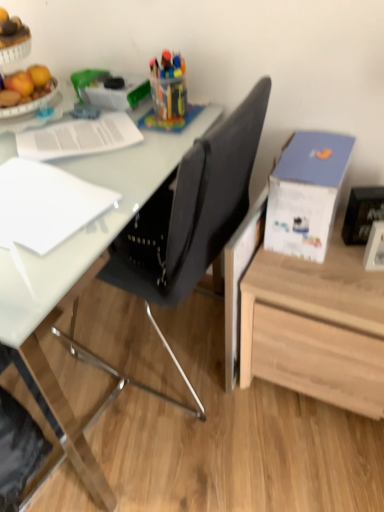
The width and height of the screenshot is (384, 512). Identify the location of free space in front of white paper at left, which is the first notebook in bottom-to-top order. (39, 273).